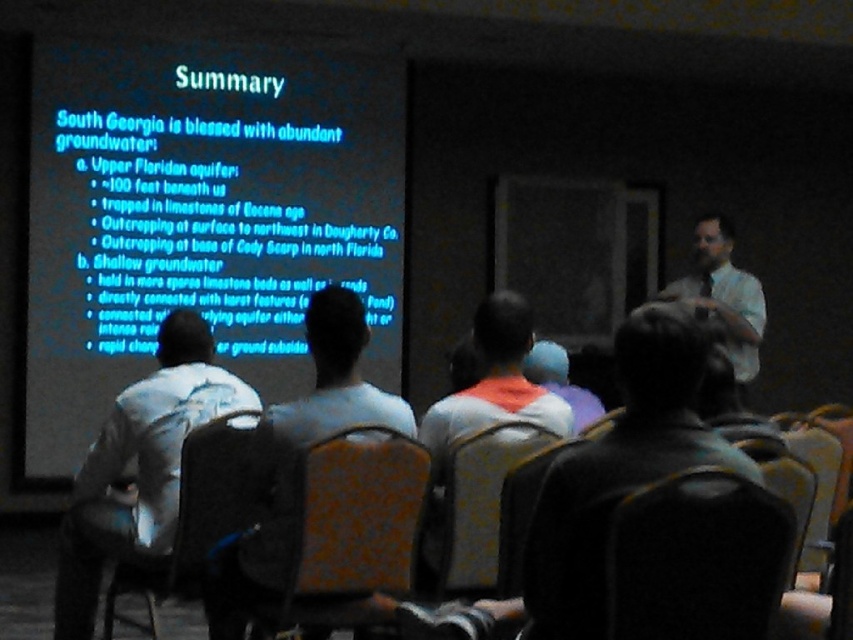
Question: Which is nearer to the black fabric chair at lower right?

Choices:
 (A) white shirt at right
 (B) velvet-like fabric chair at center
 (C) dark gray backpack at center

Answer: (C)

Question: Which object appears farthest from the camera in this image?

Choices:
 (A) black fabric chair at lower right
 (B) white shirt at right

Answer: (B)

Question: Is black fabric chair at lower right below patterned fabric chair at center?

Choices:
 (A) yes
 (B) no

Answer: (B)

Question: From the image, what is the correct spatial relationship of patterned fabric chair at center in relation to white shirt at right?

Choices:
 (A) below
 (B) above

Answer: (A)

Question: Which point is farther to the camera?

Choices:
 (A) (407, 573)
 (B) (740, 573)
 (C) (210, 444)

Answer: (C)

Question: Does dark gray backpack at center have a larger size compared to patterned fabric chair at center?

Choices:
 (A) no
 (B) yes

Answer: (B)